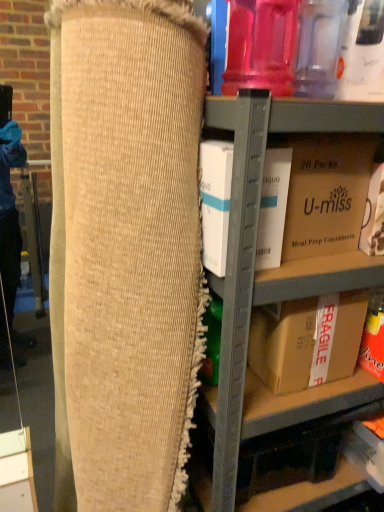
Question: From the image's perspective, is brown cardboard box at upper right, the first storage box from the left, on matte cardboard box at lower right, which is the 2th storage box in left-to-right order?

Choices:
 (A) yes
 (B) no

Answer: (A)

Question: From a real-world perspective, is brown cardboard box at upper right, the first storage box from the left, under matte cardboard box at lower right, which appears as the 1th storage box when ordered from the bottom?

Choices:
 (A) no
 (B) yes

Answer: (A)

Question: Is brown cardboard box at upper right, marked as the second storage box in a right-to-left arrangement, further to camera compared to matte cardboard box at lower right, positioned as the first storage box in right-to-left order?

Choices:
 (A) yes
 (B) no

Answer: (B)

Question: Considering the relative sizes of brown cardboard box at upper right, the first storage box from the left, and matte cardboard box at lower right, positioned as the first storage box in right-to-left order, in the image provided, is brown cardboard box at upper right, the first storage box from the left, wider than matte cardboard box at lower right, positioned as the first storage box in right-to-left order,?

Choices:
 (A) no
 (B) yes

Answer: (B)

Question: Does brown cardboard box at upper right, marked as the 2th storage box in a bottom-to-top arrangement, have a greater height compared to matte cardboard box at lower right, placed as the second storage box when sorted from top to bottom?

Choices:
 (A) yes
 (B) no

Answer: (A)

Question: Is point (256, 309) closer or farther from the camera than point (248, 297)?

Choices:
 (A) farther
 (B) closer

Answer: (A)

Question: From the image's perspective, relative to cardboard box at center, is brown cardboard box at lower right, arranged as the first box when ordered from the bottom, above or below?

Choices:
 (A) below
 (B) above

Answer: (B)

Question: Looking at their shapes, would you say brown cardboard box at lower right, marked as the second box in a front-to-back arrangement, is wider or thinner than cardboard box at center?

Choices:
 (A) wide
 (B) thin

Answer: (B)

Question: Visually, is brown cardboard box at lower right, acting as the second box starting from the top, positioned to the left or to the right of cardboard box at center?

Choices:
 (A) left
 (B) right

Answer: (A)

Question: From the image's perspective, is natural burlap bean bag chair at center positioned above or below cardboard box at center?

Choices:
 (A) above
 (B) below

Answer: (A)

Question: Is natural burlap bean bag chair at center to the left or to the right of cardboard box at center in the image?

Choices:
 (A) right
 (B) left

Answer: (B)

Question: In terms of height, does natural burlap bean bag chair at center look taller or shorter compared to cardboard box at center?

Choices:
 (A) short
 (B) tall

Answer: (B)

Question: From a real-world perspective, is natural burlap bean bag chair at center above or below cardboard box at center?

Choices:
 (A) above
 (B) below

Answer: (A)

Question: In terms of size, does white cardboard box at center, which is the 1th box from front to back, appear bigger or smaller than brown cardboard box at lower right, arranged as the first box when ordered from the bottom?

Choices:
 (A) small
 (B) big

Answer: (A)

Question: From a real-world perspective, is white cardboard box at center, the 2th box positioned from the bottom, physically located above or below brown cardboard box at lower right, arranged as the first box when ordered from the bottom?

Choices:
 (A) below
 (B) above

Answer: (B)